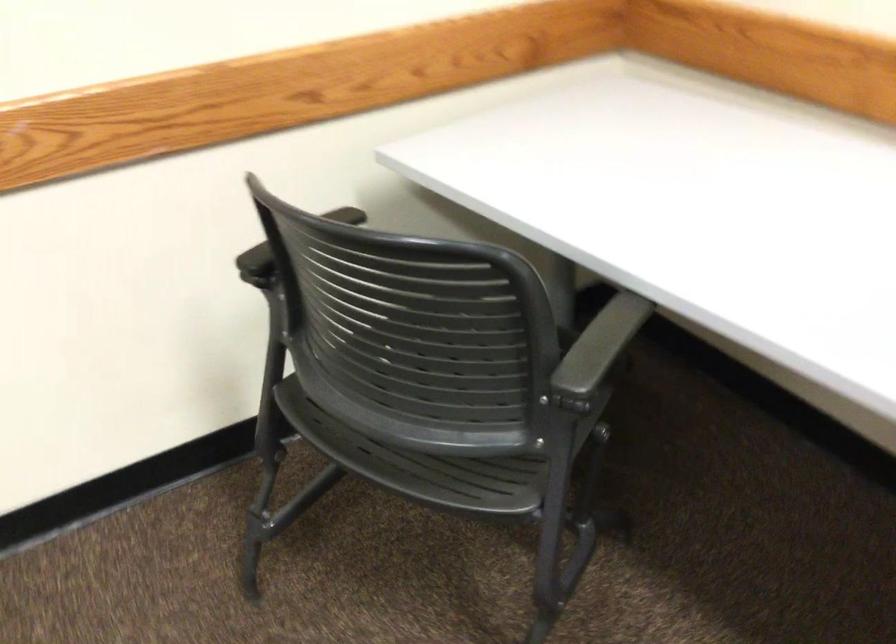
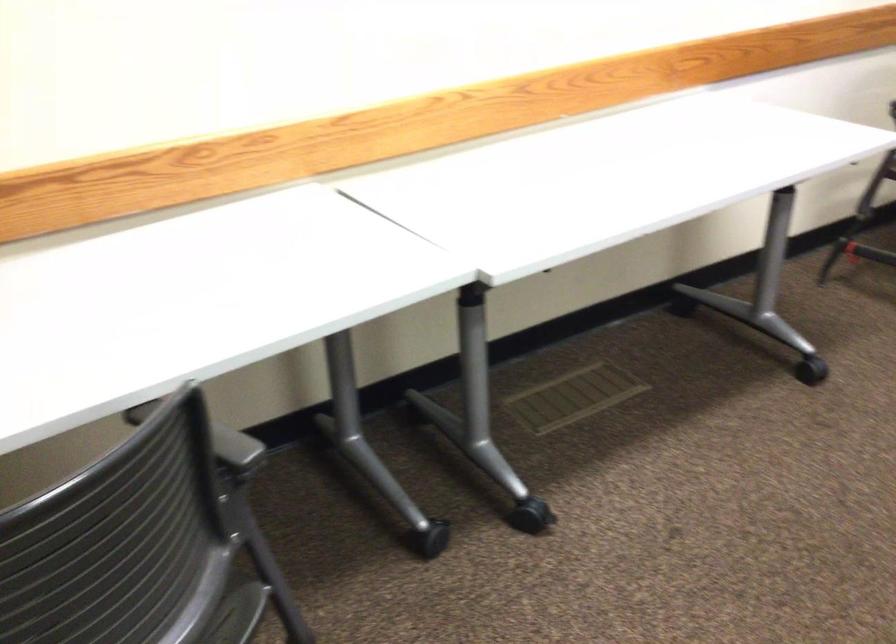
The images are taken continuously from a first-person perspective. In which direction is your viewpoint rotating?

The rotation direction of the camera is right-down.